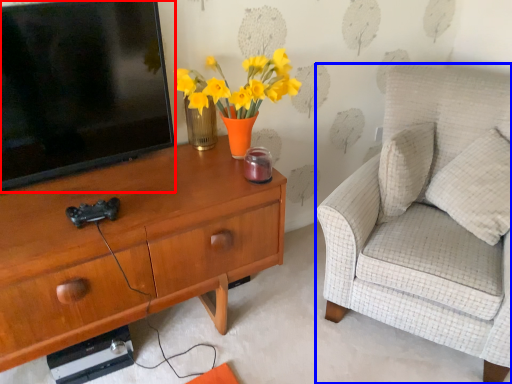
Question: Which of the following is the farthest to the observer, television (highlighted by a red box) or chair (highlighted by a blue box)?

Choices:
 (A) television
 (B) chair

Answer: (A)